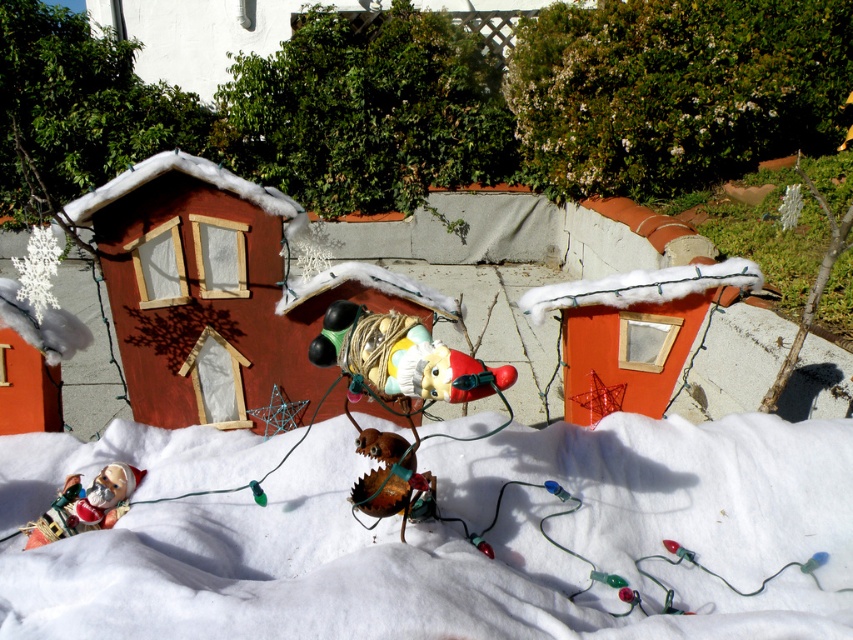
Is point (526, 545) closer to camera compared to point (32, 536)?

Yes, point (526, 545) is in front of point (32, 536).

Is white fluffy snow at center further to the viewer compared to matte plastic toy at lower left?

No, it is not.

Is point (3, 620) positioned after point (38, 531)?

No, it is in front of (38, 531).

Find the location of a particular element. The height and width of the screenshot is (640, 853). white fluffy snow at center is located at coordinates (473, 547).